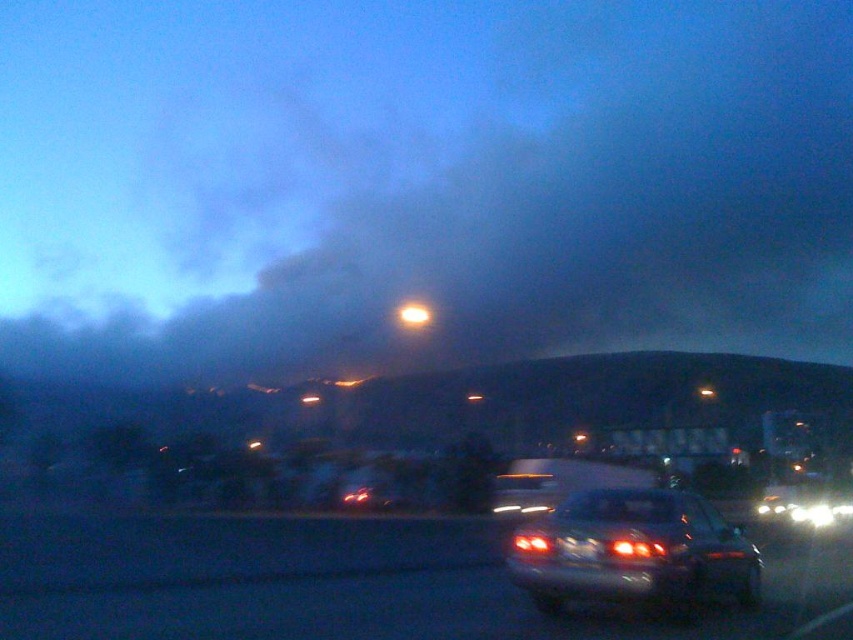
Can you confirm if metallic silver car at lower center is positioned to the left of matte silver sedan at center?

Yes, metallic silver car at lower center is to the left of matte silver sedan at center.

Does point (447, 532) come closer to viewer compared to point (708, 509)?

No, (447, 532) is behind (708, 509).

Is point (192, 529) positioned after point (711, 547)?

Yes, point (192, 529) is farther from viewer.

Find the location of a particular element. This screenshot has height=640, width=853. metallic silver car at lower center is located at coordinates (331, 582).

Is point (816, 333) positioned in front of point (521, 550)?

No, (816, 333) is behind (521, 550).

Does smoke/dense at upper center appear on the right side of matte silver sedan at center?

Incorrect, smoke/dense at upper center is not on the right side of matte silver sedan at center.

You are a GUI agent. You are given a task and a screenshot of the screen. Output one action in this format:
    pyautogui.click(x=<x>, y=<y>)
    Task: Click on the smoke/dense at upper center
    This screenshot has height=640, width=853.
    Given the screenshot: What is the action you would take?
    pyautogui.click(x=537, y=253)

Is matte silver sedan at center below white glossy car at lower right?

No, matte silver sedan at center is not below white glossy car at lower right.

Find the location of a particular element. matte silver sedan at center is located at coordinates (633, 550).

The height and width of the screenshot is (640, 853). I want to click on matte silver sedan at center, so click(x=633, y=550).